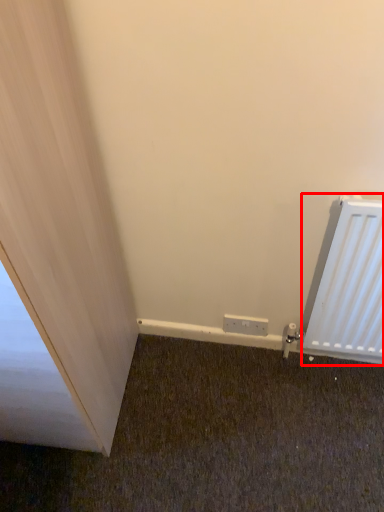
Question: Observing the image, what is the correct spatial positioning of radiator (annotated by the red box) in reference to electric outlet?

Choices:
 (A) right
 (B) left

Answer: (A)